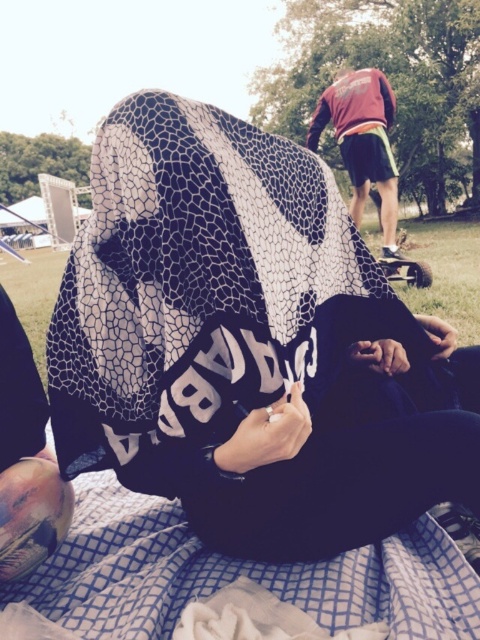
Does point (237, 564) come farther from viewer compared to point (384, 192)?

That is False.

Is blue checkered fabric at lower center shorter than maroon fabric pants at upper right?

Correct, blue checkered fabric at lower center is not as tall as maroon fabric pants at upper right.

Locate an element on the screen. This screenshot has height=640, width=480. blue checkered fabric at lower center is located at coordinates (237, 573).

Does maroon fabric pants at upper right appear on the left side of metallic silver skateboard at center?

Indeed, maroon fabric pants at upper right is positioned on the left side of metallic silver skateboard at center.

Is maroon fabric pants at upper right smaller than metallic silver skateboard at center?

No.

What do you see at coordinates (362, 141) in the screenshot? The width and height of the screenshot is (480, 640). I see `maroon fabric pants at upper right` at bounding box center [362, 141].

Identify the location of maroon fabric pants at upper right. The width and height of the screenshot is (480, 640). (362, 141).

Does point (204, 474) lie behind point (386, 108)?

No, (204, 474) is closer to viewer.

The width and height of the screenshot is (480, 640). Describe the element at coordinates (250, 346) in the screenshot. I see `matte black skateboard at upper right` at that location.

Image resolution: width=480 pixels, height=640 pixels. Find the location of `matte black skateboard at upper right`. matte black skateboard at upper right is located at coordinates (250, 346).